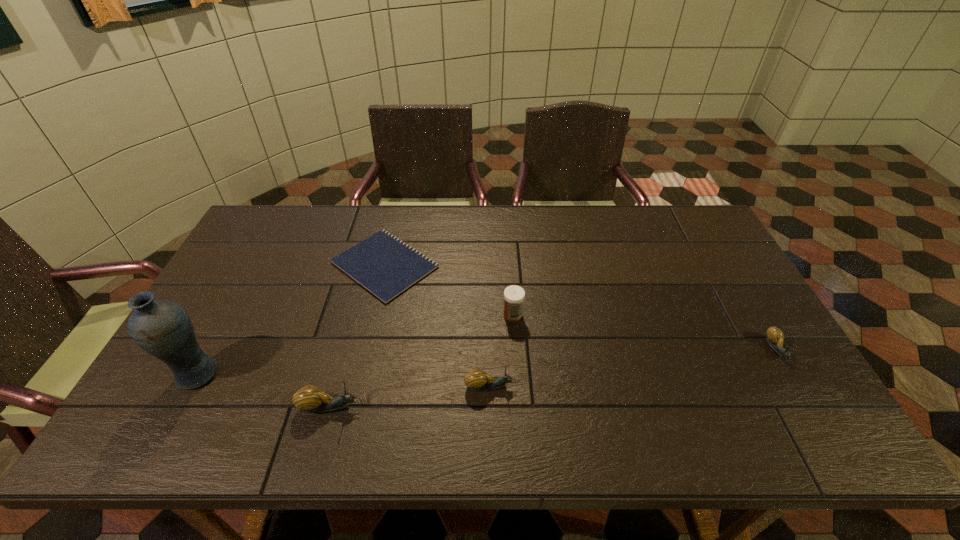
I want to click on the nearest escargot, so click(x=311, y=399).

What are the coordinates of `the leftmost escargot` in the screenshot? It's located at (311, 399).

The height and width of the screenshot is (540, 960). I want to click on the fourth tallest object, so point(476,380).

Locate an element on the screen. The height and width of the screenshot is (540, 960). the second farthest escargot is located at coordinates 476,380.

Locate an element on the screen. This screenshot has height=540, width=960. the rightmost escargot is located at coordinates (775, 337).

Locate an element on the screen. The image size is (960, 540). the shortest escargot is located at coordinates (775, 337).

Where is `notepad`? The height and width of the screenshot is (540, 960). notepad is located at coordinates (x=383, y=264).

Locate an element on the screen. The height and width of the screenshot is (540, 960). the shortest object is located at coordinates (383, 264).

Identify the location of vase. (162, 328).

You are a GUI agent. You are given a task and a screenshot of the screen. Output one action in this format:
    pyautogui.click(x=<x>, y=<y>)
    Task: Click on the leftmost object
    The width and height of the screenshot is (960, 540).
    Given the screenshot: What is the action you would take?
    pyautogui.click(x=162, y=328)